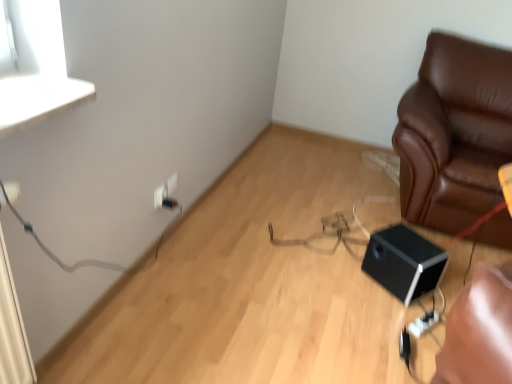
Question: Can you confirm if brown leather couch at right is thinner than black plastic electric outlet at lower left, the second electric outlet in the front-to-back sequence?

Choices:
 (A) yes
 (B) no

Answer: (B)

Question: Is brown leather couch at right at the left side of black plastic electric outlet at lower left, the second electric outlet in the front-to-back sequence?

Choices:
 (A) yes
 (B) no

Answer: (B)

Question: Is brown leather couch at right far away from black plastic electric outlet at lower left, the second electric outlet in the front-to-back sequence?

Choices:
 (A) yes
 (B) no

Answer: (A)

Question: From the image's perspective, is brown leather couch at right on black plastic electric outlet at lower left, the second electric outlet in the front-to-back sequence?

Choices:
 (A) yes
 (B) no

Answer: (A)

Question: Is brown leather couch at right shorter than black plastic electric outlet at lower left, the 2th electric outlet when ordered from back to front?

Choices:
 (A) yes
 (B) no

Answer: (B)

Question: Does brown leather couch at right have a smaller size compared to black plastic electric outlet at lower left, the 2th electric outlet when ordered from back to front?

Choices:
 (A) no
 (B) yes

Answer: (A)

Question: Is black plastic electric outlet at lower left, the 2th electric outlet when ordered from back to front, at the right side of brown leather couch at right?

Choices:
 (A) no
 (B) yes

Answer: (A)

Question: Is black plastic electric outlet at lower left, the second electric outlet in the front-to-back sequence, thinner than brown leather couch at right?

Choices:
 (A) no
 (B) yes

Answer: (B)

Question: Are black plastic electric outlet at lower left, the 2th electric outlet when ordered from back to front, and brown leather couch at right making contact?

Choices:
 (A) yes
 (B) no

Answer: (B)

Question: Considering the relative positions of black plastic electric outlet at lower left, the 2th electric outlet when ordered from back to front, and brown leather couch at right in the image provided, is black plastic electric outlet at lower left, the 2th electric outlet when ordered from back to front, to the left of brown leather couch at right from the viewer's perspective?

Choices:
 (A) no
 (B) yes

Answer: (B)

Question: Is black plastic electric outlet at lower left, the second electric outlet in the front-to-back sequence, outside of brown leather couch at right?

Choices:
 (A) no
 (B) yes

Answer: (B)

Question: From the image's perspective, is black plastic electric outlet at lower left, the second electric outlet in the front-to-back sequence, below brown leather couch at right?

Choices:
 (A) yes
 (B) no

Answer: (A)

Question: Is black matte speaker at lower right outside of white plastic electric outlet at upper center, the 1th electric outlet viewed from the front?

Choices:
 (A) yes
 (B) no

Answer: (A)